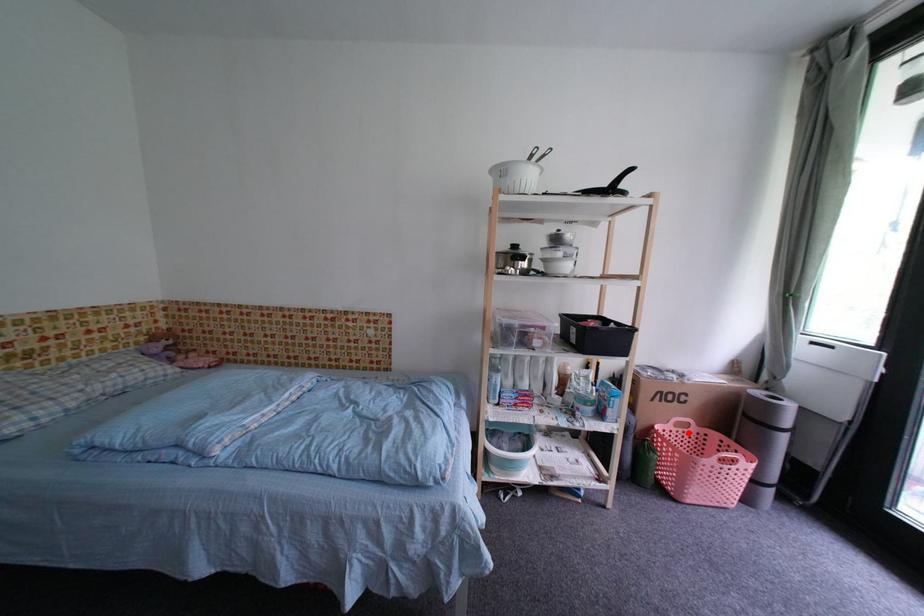
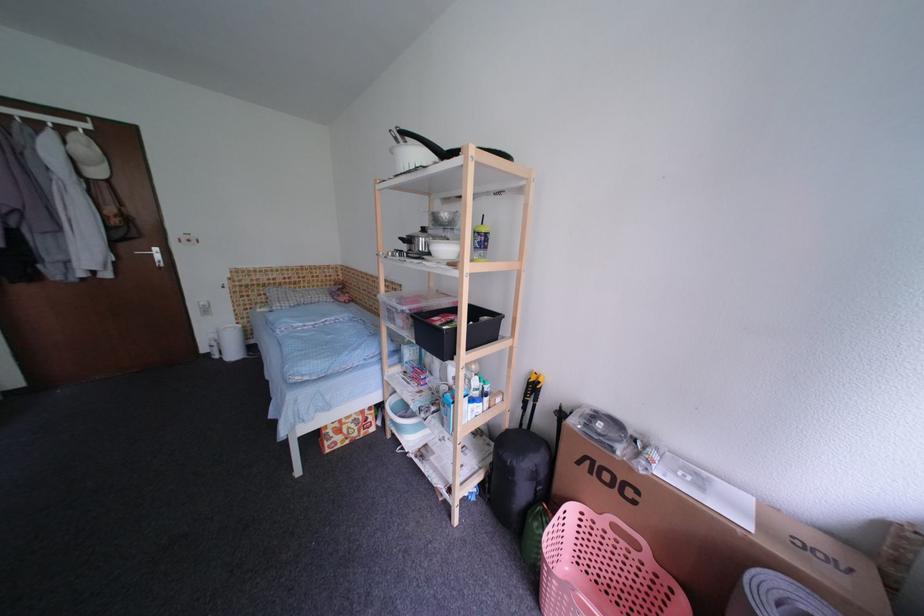
Question: I am providing you with two images of the same scene from different viewpoints. Image1 has a red point marked. In image2, the corresponding 3D location appears at what relative position? Reply with the corresponding letter.

Choices:
 (A) Closer
 (B) Farther

Answer: (A)